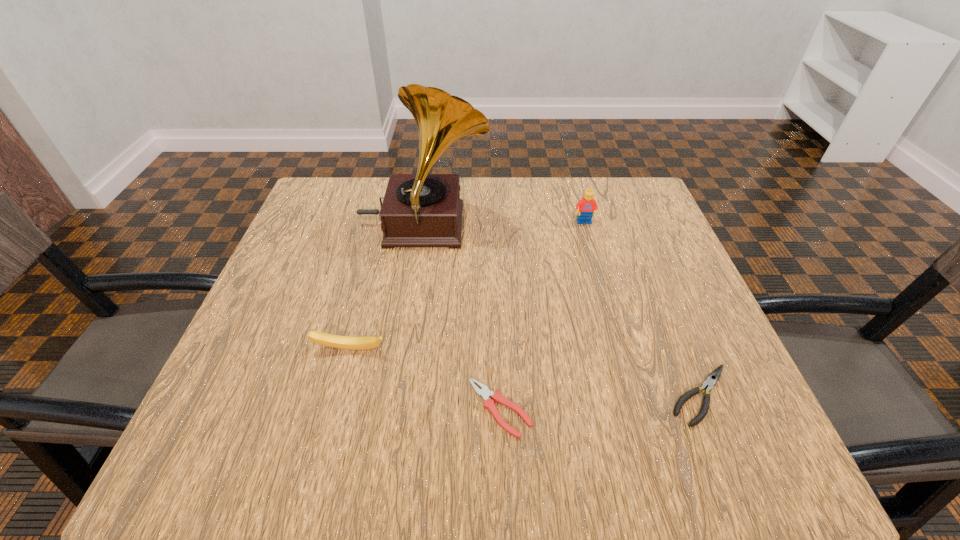
You are a GUI agent. You are given a task and a screenshot of the screen. Output one action in this format:
    pyautogui.click(x=<x>, y=<y>)
    Task: Click on the free space that satisfies the following two spatial constraints: 1. on the face of the Lego; 2. from the horn of the tallest object
    The image size is (960, 540).
    Given the screenshot: What is the action you would take?
    pyautogui.click(x=585, y=226)

The height and width of the screenshot is (540, 960). Identify the location of free region that satisfies the following two spatial constraints: 1. at the stem of the shortest object; 2. on the right side of the third nearest object. (335, 408).

Locate an element on the screen. This screenshot has width=960, height=540. vacant space that satisfies the following two spatial constraints: 1. at the stem of the rightmost object; 2. on the left side of the third farthest object is located at coordinates (338, 395).

What are the coordinates of `free location that satisfies the following two spatial constraints: 1. on the face of the second tallest object; 2. from the horn of the tallest object` in the screenshot? It's located at (585, 226).

Image resolution: width=960 pixels, height=540 pixels. I want to click on free space that satisfies the following two spatial constraints: 1. from the horn of the tallest object; 2. at the stem of the third shortest object, so click(x=406, y=349).

This screenshot has width=960, height=540. Find the location of `vacant space that satisfies the following two spatial constraints: 1. from the horn of the rightmost object; 2. on the right side of the phonograph record`. vacant space that satisfies the following two spatial constraints: 1. from the horn of the rightmost object; 2. on the right side of the phonograph record is located at coordinates (398, 395).

This screenshot has width=960, height=540. What are the coordinates of `vacant area that satisfies the following two spatial constraints: 1. on the face of the right pliers; 2. on the right side of the second object from right to left` in the screenshot? It's located at (633, 395).